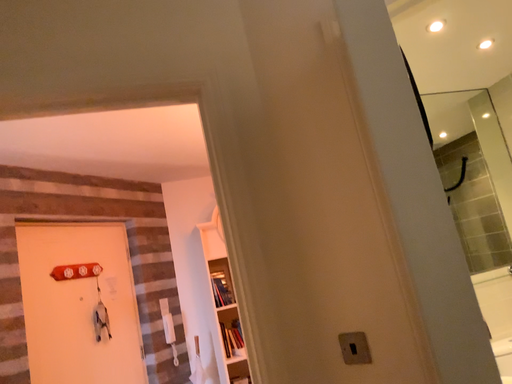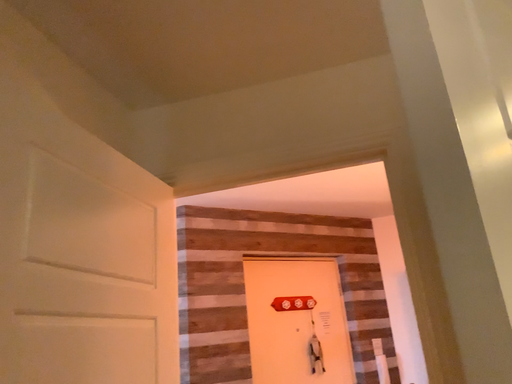
Question: How did the camera likely rotate when shooting the video?

Choices:
 (A) rotated left
 (B) rotated right

Answer: (A)